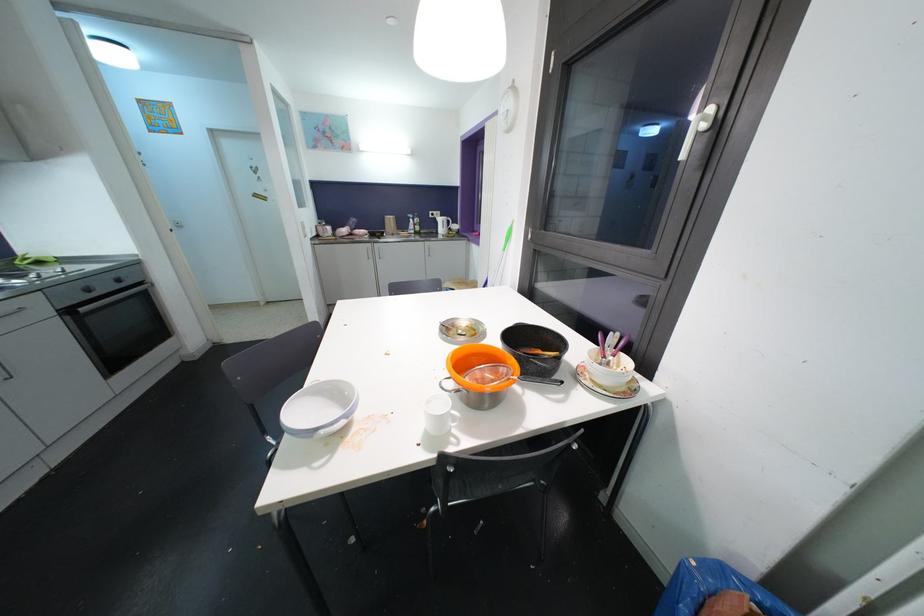
Identify the location of metal strainer handle. (455, 389).